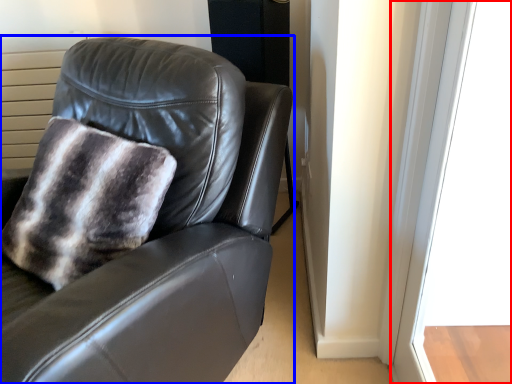
Question: Which object is further to the camera taking this photo, window (highlighted by a red box) or chair (highlighted by a blue box)?

Choices:
 (A) window
 (B) chair

Answer: (B)